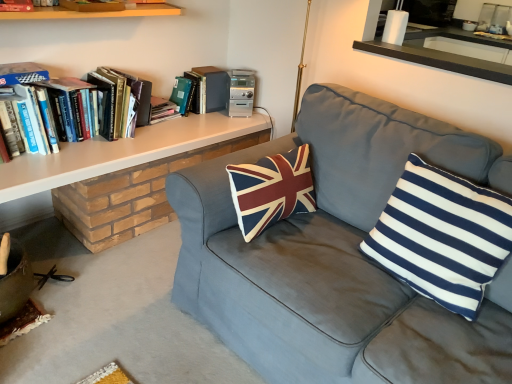
Question: Relative to hardcover book at upper left, which ranks as the first book in front-to-back order, is white/blue striped pillow at right in front or behind?

Choices:
 (A) front
 (B) behind

Answer: (A)

Question: Considering the positions of white/blue striped pillow at right and hardcover book at upper left, the fourth book when ordered from back to front, in the image, is white/blue striped pillow at right bigger or smaller than hardcover book at upper left, the fourth book when ordered from back to front,?

Choices:
 (A) big
 (B) small

Answer: (A)

Question: Which of these objects is positioned farthest from the hardcover book at upper left, which ranks as the first book in front-to-back order?

Choices:
 (A) hardcover book at upper left, which ranks as the second book in back-to-front order
 (B) hardcover book at upper center, acting as the first book starting from the back
 (C) white/blue striped pillow at right
 (D) white glossy mirror at upper right
 (E) hardcover books at left, marked as the 2th book in a front-to-back arrangement

Answer: (C)

Question: Which object is positioned closest to the white matte shelf at upper left?

Choices:
 (A) hardcover books at left, marked as the 2th book in a front-to-back arrangement
 (B) white glossy mirror at upper right
 (C) matte gray couch at center
 (D) white/blue striped pillow at right
 (E) hardcover book at upper left, which ranks as the first book in front-to-back order

Answer: (A)